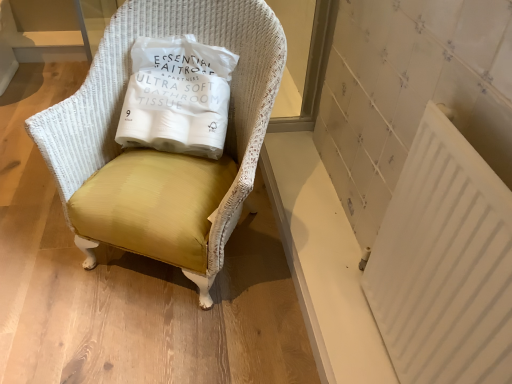
Where is `free point in front of matte yellow fabric chair at center`? This screenshot has height=384, width=512. free point in front of matte yellow fabric chair at center is located at coordinates (150, 334).